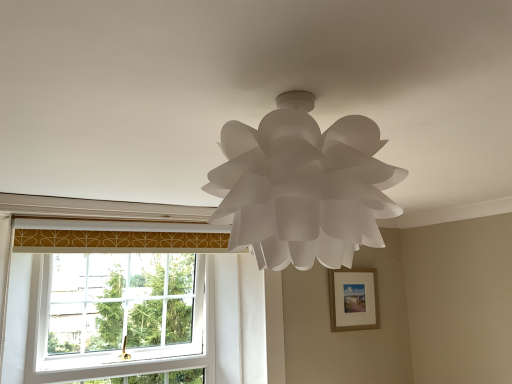
This screenshot has width=512, height=384. Describe the element at coordinates (303, 186) in the screenshot. I see `white paper lamp at center` at that location.

Find the location of `white paper lamp at center`. white paper lamp at center is located at coordinates (303, 186).

Which is more to the left, white paper lamp at center or wooden picture frame at center-right?

white paper lamp at center.

From the image's perspective, is white paper lamp at center beneath wooden picture frame at center-right?

No, from the image's perspective, white paper lamp at center is not below wooden picture frame at center-right.

Considering the relative sizes of white paper lamp at center and wooden picture frame at center-right in the image provided, is white paper lamp at center smaller than wooden picture frame at center-right?

No, white paper lamp at center is not smaller than wooden picture frame at center-right.

Can you tell me how much wooden picture frame at center-right and white plastic window at lower left differ in facing direction?

The angular difference between wooden picture frame at center-right and white plastic window at lower left is 1.43 degrees.

Does wooden picture frame at center-right turn towards white plastic window at lower left?

No, wooden picture frame at center-right is not facing towards white plastic window at lower left.

At what (x,y) coordinates should I click in order to perform the action: click on window in front of the wooden picture frame at center-right. Please return your answer as a coordinate pair (x, y). This screenshot has height=384, width=512. Looking at the image, I should click on (119, 321).

Which is behind, point (365, 296) or point (54, 366)?

Positioned behind is point (365, 296).

Is white plastic window at lower left taller than white paper lamp at center?

Correct, white plastic window at lower left is much taller as white paper lamp at center.

Locate an element on the screen. window that is below the white paper lamp at center (from the image's perspective) is located at coordinates (119, 321).

Can you tell me how much white plastic window at lower left and white paper lamp at center differ in facing direction?

2.37 degrees.

Is point (127, 260) closer to camera compared to point (313, 164)?

No.

Is white paper lamp at center at the left side of white plastic window at lower left?

No.

Is white plastic window at lower left located within white paper lamp at center?

That's incorrect, white plastic window at lower left is not inside white paper lamp at center.

From a real-world perspective, between white paper lamp at center and white plastic window at lower left, who is vertically higher?

In real-world perspective, white paper lamp at center is above.

Where is `lamp above the white plastic window at lower left (from the image's perspective)`? This screenshot has width=512, height=384. lamp above the white plastic window at lower left (from the image's perspective) is located at coordinates (303, 186).

In the scene shown: Is white plastic window at lower left at the left side of wooden picture frame at center-right?

Correct, you'll find white plastic window at lower left to the left of wooden picture frame at center-right.

Between white plastic window at lower left and wooden picture frame at center-right, which one has smaller size?

wooden picture frame at center-right is smaller.

Is white plastic window at lower left facing away from wooden picture frame at center-right?

No, white plastic window at lower left is not facing away from wooden picture frame at center-right.

Based on their sizes in the image, would you say wooden picture frame at center-right is bigger or smaller than white paper lamp at center?

In the image, wooden picture frame at center-right appears to be smaller than white paper lamp at center.

Is point (350, 293) positioned in front of point (324, 190)?

That is False.

Is white paper lamp at center a part of wooden picture frame at center-right?

No, wooden picture frame at center-right does not contain white paper lamp at center.

Is wooden picture frame at center-right facing towards white paper lamp at center?

No, wooden picture frame at center-right is not turned towards white paper lamp at center.

Image resolution: width=512 pixels, height=384 pixels. In the image, there is a white paper lamp at center. What are the coordinates of `picture frame below it (from a real-world perspective)` in the screenshot? It's located at (353, 300).

Identify the location of window below the wooden picture frame at center-right (from the image's perspective). The height and width of the screenshot is (384, 512). (119, 321).

Which object lies nearer to the anchor point wooden picture frame at center-right, white paper lamp at center or white plastic window at lower left?

white plastic window at lower left lies closer to wooden picture frame at center-right than the other object.

Considering their positions, is white plastic window at lower left positioned closer to white paper lamp at center than wooden picture frame at center-right?

Based on the image, white plastic window at lower left appears to be nearer to white paper lamp at center.

Based on their spatial positions, is wooden picture frame at center-right or white plastic window at lower left further from white paper lamp at center?

Among the two, wooden picture frame at center-right is located further to white paper lamp at center.

When comparing their distances from wooden picture frame at center-right, does white plastic window at lower left or white paper lamp at center seem further?

A: Based on the image, white paper lamp at center appears to be further to wooden picture frame at center-right.

Considering their positions, is white paper lamp at center positioned further to white plastic window at lower left than wooden picture frame at center-right?

Among the two, white paper lamp at center is located further to white plastic window at lower left.

Which object lies nearer to the anchor point white plastic window at lower left, wooden picture frame at center-right or white paper lamp at center?

Among the two, wooden picture frame at center-right is located nearer to white plastic window at lower left.

At what (x,y) coordinates should I click in order to perform the action: click on window located between white paper lamp at center and wooden picture frame at center-right in the depth direction. Please return your answer as a coordinate pair (x, y). The image size is (512, 384). Looking at the image, I should click on (119, 321).